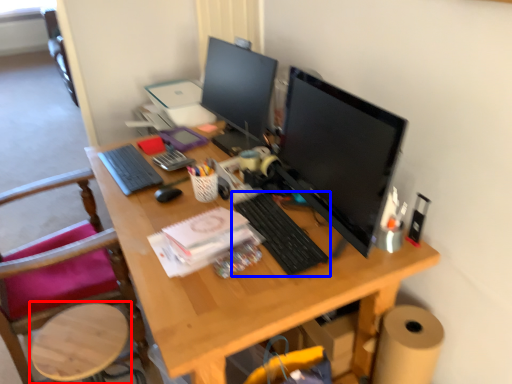
Question: Among these objects, which one is farthest to the camera, round table (highlighted by a red box) or computer keyboard (highlighted by a blue box)?

Choices:
 (A) round table
 (B) computer keyboard

Answer: (A)